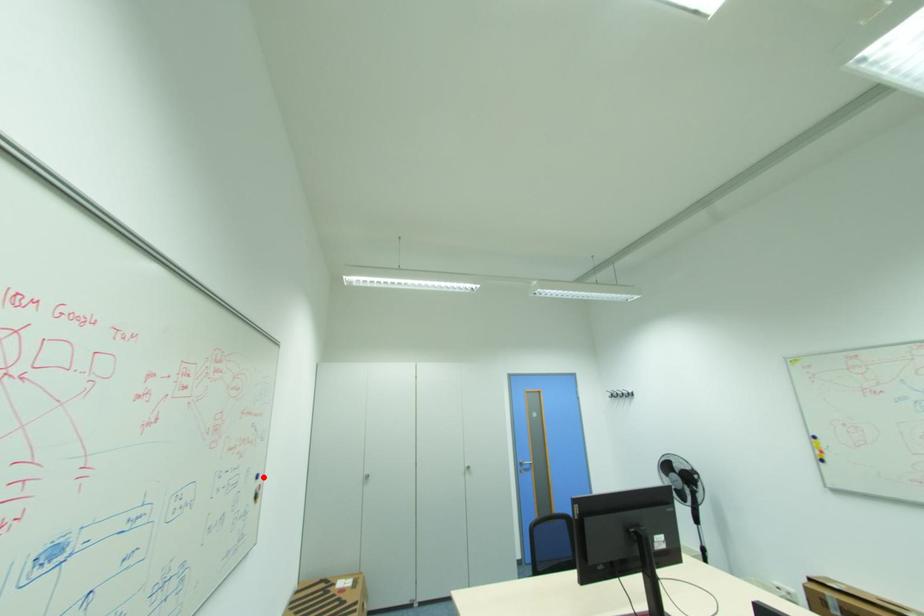
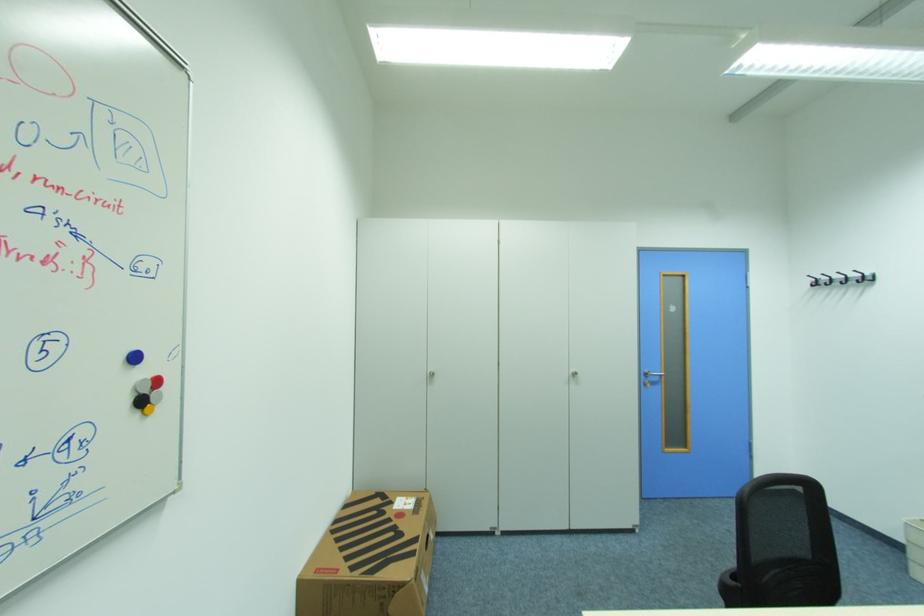
Where in the second image is the point corresponding to the highlighted location from the first image?

(140, 359)